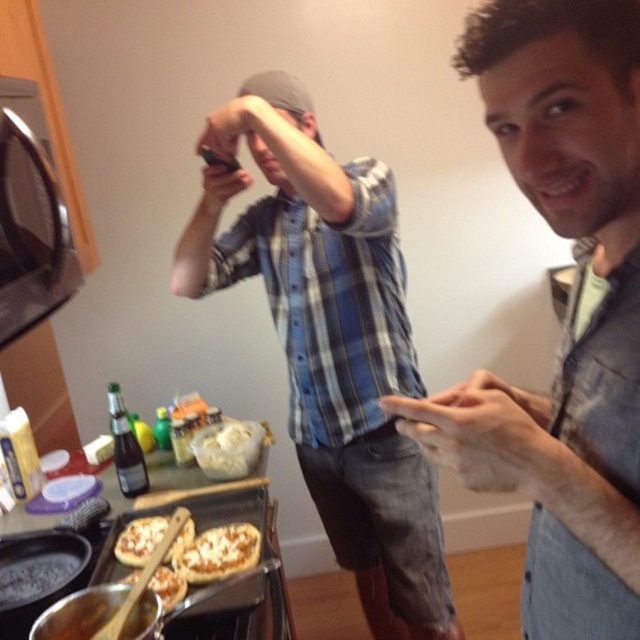
Question: Does black glass exhaust hood at upper left have a larger size compared to golden crispy pizza at lower left?

Choices:
 (A) yes
 (B) no

Answer: (A)

Question: Estimate the real-world distances between objects in this image. Which object is farther from the golden crispy pizza at center?

Choices:
 (A) golden crispy pizza at lower left
 (B) blue plaid shirt at center
 (C) gray casual shirt at center
 (D) black glass exhaust hood at upper left

Answer: (C)

Question: Which point is closer to the camera?

Choices:
 (A) blue plaid shirt at center
 (B) gray casual shirt at center
 (C) black glass exhaust hood at upper left

Answer: (B)

Question: From the image, what is the correct spatial relationship of golden crispy pizza at lower left in relation to golden crispy pizza at center?

Choices:
 (A) left
 (B) right

Answer: (A)

Question: Which of the following is the farthest from the observer?

Choices:
 (A) (246, 531)
 (B) (504, 60)

Answer: (A)

Question: Is cheesy pizza at center bigger than golden crispy pizza at lower left?

Choices:
 (A) no
 (B) yes

Answer: (A)